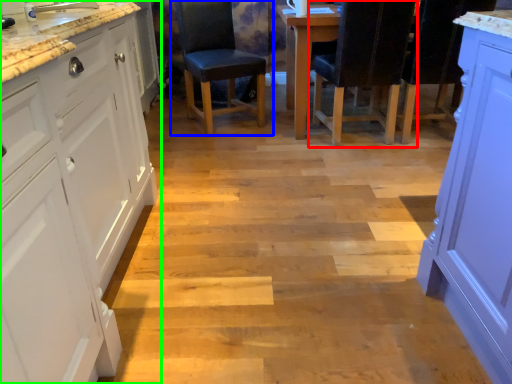
Question: Which object is the farthest from chair (highlighted by a red box)? Choose among these: chair (highlighted by a blue box) or cabinetry (highlighted by a green box).

Choices:
 (A) chair
 (B) cabinetry

Answer: (B)